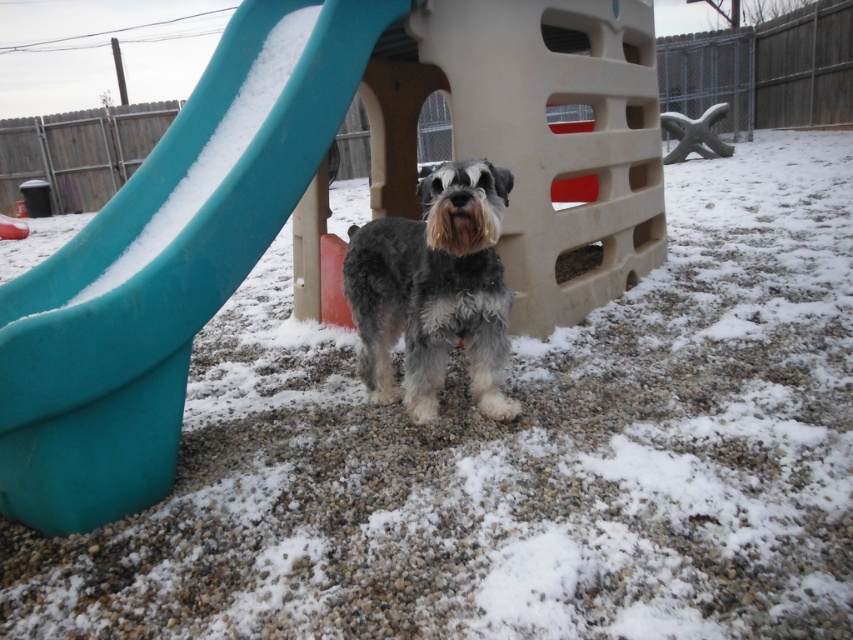
Question: Does teal plastic slide at left have a smaller size compared to gray shaggy dog at center?

Choices:
 (A) yes
 (B) no

Answer: (B)

Question: Does teal plastic slide at left appear on the right side of gray shaggy dog at center?

Choices:
 (A) yes
 (B) no

Answer: (B)

Question: Among these points, which one is nearest to the camera?

Choices:
 (A) (154, 483)
 (B) (350, 252)

Answer: (A)

Question: Can you confirm if teal plastic slide at left is positioned below gray shaggy dog at center?

Choices:
 (A) yes
 (B) no

Answer: (B)